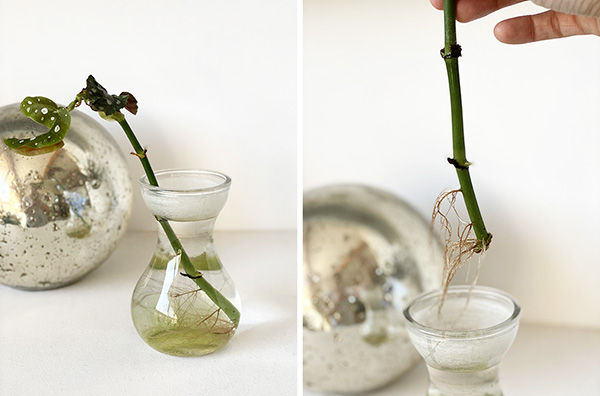
Locate an element on the screen. rim of vase is located at coordinates (498, 305).